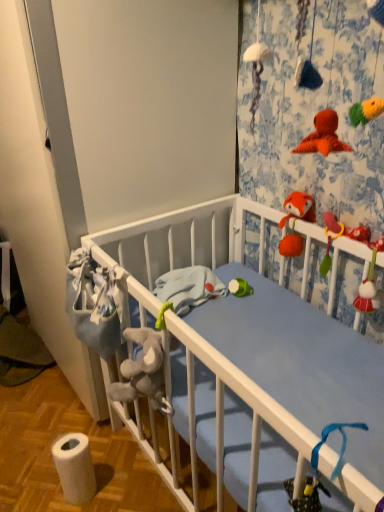
Question: Is white matte toilet paper at lower left in front of or behind fluffy orange fox at upper right in the image?

Choices:
 (A) front
 (B) behind

Answer: (A)

Question: In terms of size, does white matte toilet paper at lower left appear bigger or smaller than fluffy orange fox at upper right?

Choices:
 (A) big
 (B) small

Answer: (A)

Question: Considering the positions of white matte toilet paper at lower left and fluffy orange fox at upper right in the image, is white matte toilet paper at lower left taller or shorter than fluffy orange fox at upper right?

Choices:
 (A) tall
 (B) short

Answer: (A)

Question: From a real-world perspective, is fluffy orange fox at upper right physically located above or below white matte toilet paper at lower left?

Choices:
 (A) below
 (B) above

Answer: (B)

Question: Is fluffy orange fox at upper right wider or thinner than white matte toilet paper at lower left?

Choices:
 (A) wide
 (B) thin

Answer: (B)

Question: Is fluffy orange fox at upper right situated inside white matte toilet paper at lower left or outside?

Choices:
 (A) inside
 (B) outside

Answer: (B)

Question: Looking at the image, does fluffy orange fox at upper right seem bigger or smaller compared to white matte toilet paper at lower left?

Choices:
 (A) small
 (B) big

Answer: (A)